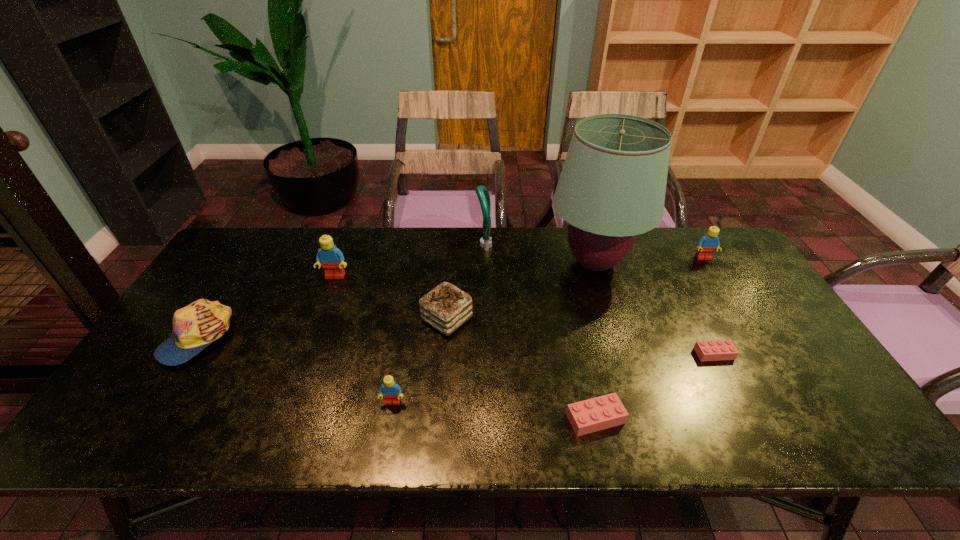
Identify the location of vacant area that lies between the leftmost object and the second object from right to left. The image size is (960, 540). (456, 345).

What are the coordinates of `free space between the fourth tallest Lego and the farther pink Lego` in the screenshot? It's located at (655, 386).

Identify the location of free spot between the shortest Lego and the chocolate cake. (581, 336).

This screenshot has height=540, width=960. Find the location of `vacant area that lies between the bottle opener and the second Lego from right to left`. vacant area that lies between the bottle opener and the second Lego from right to left is located at coordinates pyautogui.click(x=599, y=299).

Select which object is the sixth closest to the fourth tallest object. Please provide its 2D coordinates. Your answer should be formatted as a tuple, i.e. [(x, y)], where the tuple contains the x and y coordinates of a point satisfying the conditions above.

[(391, 391)]

I want to click on object that ranks as the sixth closest to the nearer pink Lego, so click(x=707, y=244).

Find the location of a particular element. The height and width of the screenshot is (540, 960). Lego that is the fourth closest to the shortest Lego is located at coordinates (332, 259).

This screenshot has width=960, height=540. What are the coordinates of `Lego that is the nearest to the tallest object` in the screenshot? It's located at (707, 244).

Find the location of a particular element. This screenshot has height=540, width=960. blue Lego that is the second nearest to the second Lego from left to right is located at coordinates (707, 244).

Identify which blue Lego is the second nearest to the second shortest object. Please provide its 2D coordinates. Your answer should be formatted as a tuple, i.e. [(x, y)], where the tuple contains the x and y coordinates of a point satisfying the conditions above.

[(707, 244)]